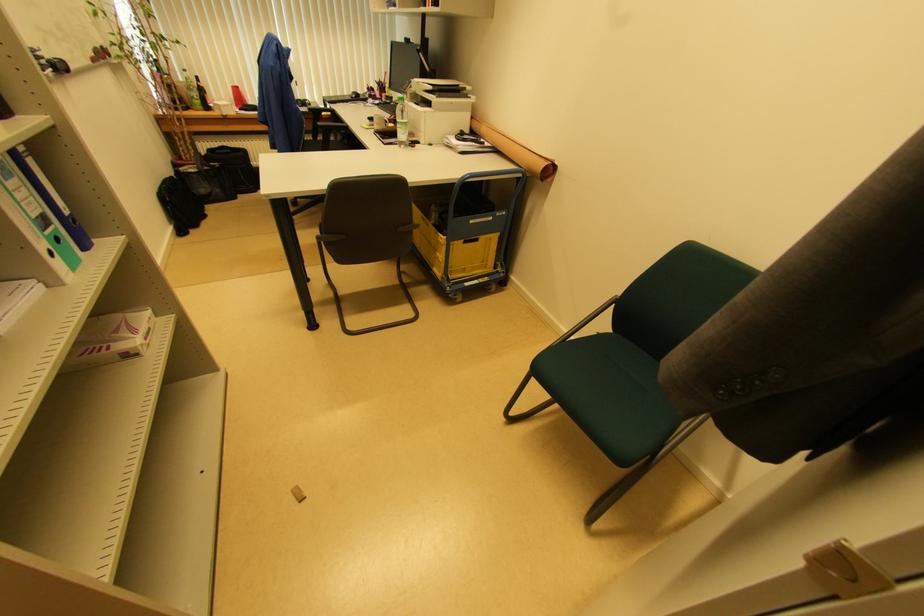
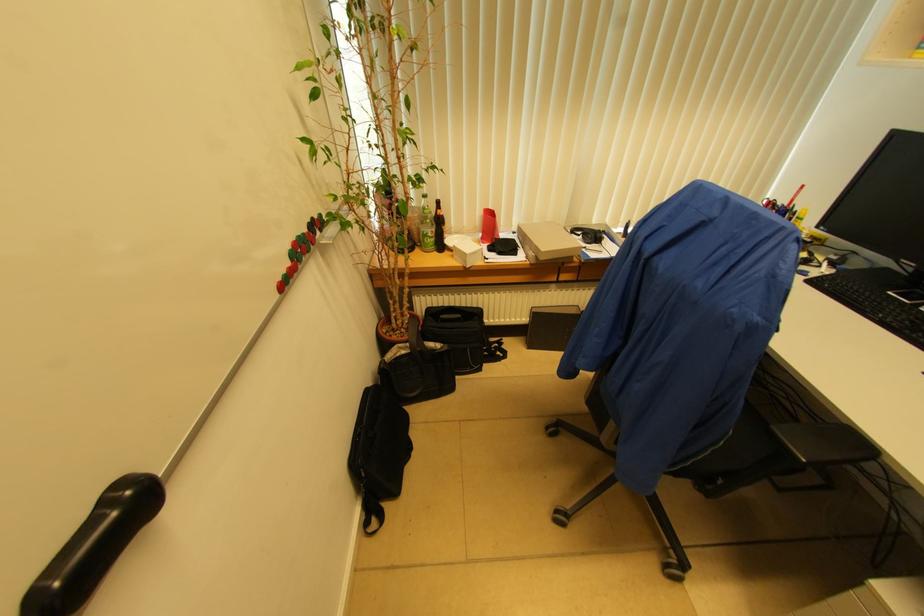
In the second image, find the point that corresponds to point (205, 219) in the first image.

(409, 451)